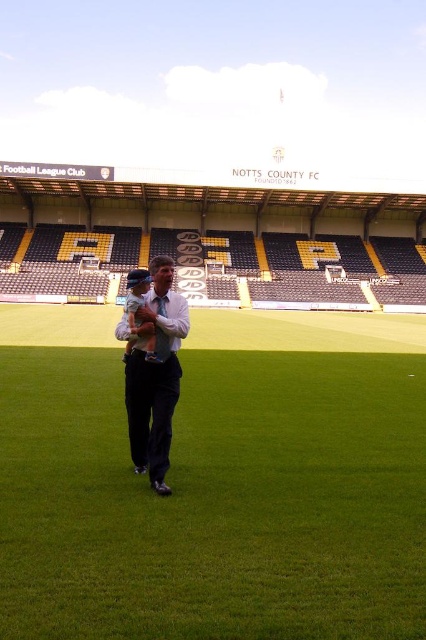
Does green artificial turf at center appear on the right side of white shirt at center?

Indeed, green artificial turf at center is positioned on the right side of white shirt at center.

Locate an element on the screen. This screenshot has width=426, height=640. green artificial turf at center is located at coordinates (215, 481).

The width and height of the screenshot is (426, 640). I want to click on green artificial turf at center, so click(215, 481).

Does white shirt at center appear on the right side of light blue fabric baby at center?

Indeed, white shirt at center is positioned on the right side of light blue fabric baby at center.

Who is more distant from viewer, (163, 339) or (150, 333)?

Positioned behind is point (163, 339).

The width and height of the screenshot is (426, 640). Find the location of `white shirt at center`. white shirt at center is located at coordinates [155, 376].

Who is higher up, green artificial turf at center or light blue fabric baby at center?

light blue fabric baby at center is above.

Does green artificial turf at center have a greater width compared to light blue fabric baby at center?

Yes.

What do you see at coordinates (215, 481) in the screenshot? I see `green artificial turf at center` at bounding box center [215, 481].

Identify the location of green artificial turf at center. (215, 481).